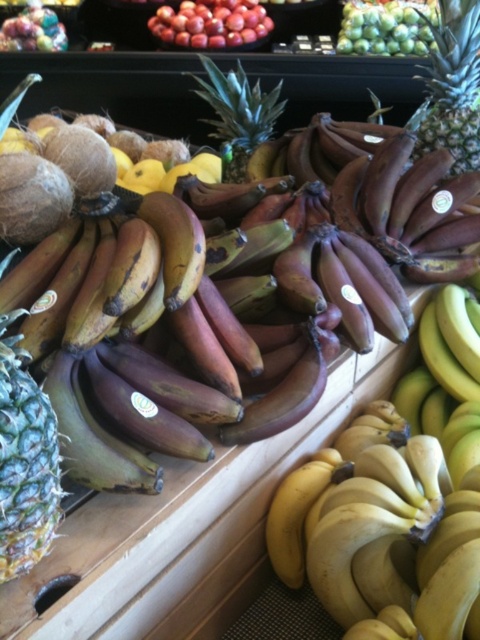
Between yellow textured pineapple at lower left and green textured pineapple at upper right, which one appears on the right side from the viewer's perspective?

From the viewer's perspective, green textured pineapple at upper right appears more on the right side.

Is yellow textured pineapple at lower left positioned in front of green textured pineapple at upper right?

Yes.

The width and height of the screenshot is (480, 640). I want to click on yellow textured pineapple at lower left, so click(x=24, y=460).

The image size is (480, 640). Identify the location of yellow textured pineapple at lower left. (24, 460).

Does shiny red apples at upper center lie in front of green matte grapes at upper center?

No.

In the scene shown: Which of these two, shiny red apples at upper center or green matte grapes at upper center, stands shorter?

shiny red apples at upper center

Find the location of a particular element. This screenshot has height=640, width=480. shiny red apples at upper center is located at coordinates (211, 22).

You are a GUI agent. You are given a task and a screenshot of the screen. Output one action in this format:
    pyautogui.click(x=<x>, y=<y>)
    Task: Click on the shiny red apples at upper center
    Image resolution: width=480 pixels, height=640 pixels.
    Given the screenshot: What is the action you would take?
    pyautogui.click(x=211, y=22)

Between point (247, 115) and point (343, 26), which one is positioned in front?

Positioned in front is point (247, 115).

Between green spiky pineapple at center and green matte grapes at upper center, which one is positioned lower?

Positioned lower is green spiky pineapple at center.

Is point (220, 128) positioned after point (384, 16)?

That is False.

Where is `green spiky pineapple at center`? This screenshot has height=640, width=480. green spiky pineapple at center is located at coordinates coord(238,115).